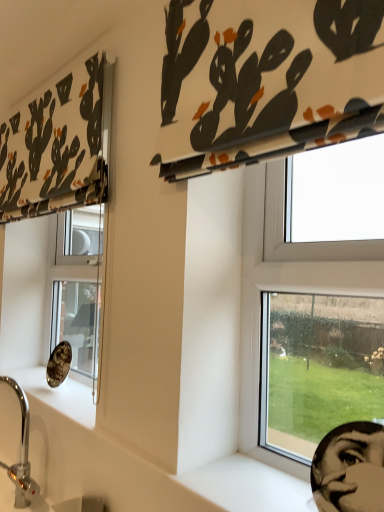
In order to face chrome metallic sink at lower left, should I rotate leftwards or rightwards?

To face it directly, rotate left by 23.007 degrees.

At what (x,y) coordinates should I click in order to perform the action: click on chrome metallic sink at lower left. Please return your answer as a coordinate pair (x, y). Looking at the image, I should click on (30, 471).

What do you see at coordinates (252, 482) in the screenshot?
I see `white smooth window sill at lower right` at bounding box center [252, 482].

The image size is (384, 512). Find the location of `white fabric with black and orange cactus print at upper left, the 1th curtain in the left-to-right sequence`. white fabric with black and orange cactus print at upper left, the 1th curtain in the left-to-right sequence is located at coordinates click(x=59, y=145).

What do you see at coordinates (59, 145) in the screenshot? This screenshot has width=384, height=512. I see `white fabric with black and orange cactus print at upper left, the 1th curtain in the left-to-right sequence` at bounding box center [59, 145].

What are the coordinates of `chrome metallic sink at lower left` in the screenshot? It's located at (30, 471).

Is matte black fabric at upper center, which appears as the 1th curtain when viewed from the front, in front of or behind chrome metallic sink at lower left in the image?

matte black fabric at upper center, which appears as the 1th curtain when viewed from the front, is positioned closer to the viewer than chrome metallic sink at lower left.

Can you confirm if matte black fabric at upper center, arranged as the first curtain when viewed from the right, is taller than chrome metallic sink at lower left?

Correct, matte black fabric at upper center, arranged as the first curtain when viewed from the right, is much taller as chrome metallic sink at lower left.

From a real-world perspective, between matte black fabric at upper center, the 2th curtain positioned from the left, and chrome metallic sink at lower left, who is vertically higher?

matte black fabric at upper center, the 2th curtain positioned from the left, from a real-world perspective.

Which object is wider, matte black fabric at upper center, which appears as the 1th curtain when viewed from the front, or chrome metallic sink at lower left?

chrome metallic sink at lower left is wider.

Does transparent glass window at center right have a smaller size compared to white fabric with black and orange cactus print at upper left, the 1th curtain in the left-to-right sequence?

Correct, transparent glass window at center right occupies less space than white fabric with black and orange cactus print at upper left, the 1th curtain in the left-to-right sequence.

Who is taller, transparent glass window at center right or white fabric with black and orange cactus print at upper left, the first curtain from the back?

With more height is transparent glass window at center right.

Is transparent glass window at center right turned away from white fabric with black and orange cactus print at upper left, the 1th curtain in the left-to-right sequence?

transparent glass window at center right does not have its back to white fabric with black and orange cactus print at upper left, the 1th curtain in the left-to-right sequence.

Where is `window that is on the right side of white fabric with black and orange cactus print at upper left, marked as the second curtain in a right-to-left arrangement`? The image size is (384, 512). window that is on the right side of white fabric with black and orange cactus print at upper left, marked as the second curtain in a right-to-left arrangement is located at coordinates (288, 275).

What's the angular difference between transparent glass window at center right and black matte human face at lower right's facing directions?

The angular difference between transparent glass window at center right and black matte human face at lower right is 3.98 degrees.

Between transparent glass window at center right and black matte human face at lower right, which one has smaller size?

With smaller size is black matte human face at lower right.

Is the surface of transparent glass window at center right in direct contact with black matte human face at lower right?

There is a gap between transparent glass window at center right and black matte human face at lower right.

Consider the image. Is transparent glass window at center right in front of black matte human face at lower right?

No, it is not.

In the scene shown: Does black matte human face at lower right have a lesser width compared to white fabric with black and orange cactus print at upper left, the 1th curtain in the left-to-right sequence?

In fact, black matte human face at lower right might be wider than white fabric with black and orange cactus print at upper left, the 1th curtain in the left-to-right sequence.

In the image, is black matte human face at lower right positioned in front of or behind white fabric with black and orange cactus print at upper left, the 2th curtain viewed from the front?

black matte human face at lower right is in front of white fabric with black and orange cactus print at upper left, the 2th curtain viewed from the front.

From the image's perspective, is black matte human face at lower right located above or below white fabric with black and orange cactus print at upper left, the 1th curtain in the left-to-right sequence?

Based on their image positions, black matte human face at lower right is located beneath white fabric with black and orange cactus print at upper left, the 1th curtain in the left-to-right sequence.

In the scene shown: From their relative heights in the image, would you say white fabric with black and orange cactus print at upper left, marked as the second curtain in a right-to-left arrangement, is taller or shorter than matte black fabric at upper center, arranged as the first curtain when viewed from the right?

Clearly, white fabric with black and orange cactus print at upper left, marked as the second curtain in a right-to-left arrangement, is taller compared to matte black fabric at upper center, arranged as the first curtain when viewed from the right.

How different are the orientations of white fabric with black and orange cactus print at upper left, the 2th curtain viewed from the front, and matte black fabric at upper center, arranged as the first curtain when viewed from the right, in degrees?

The facing directions of white fabric with black and orange cactus print at upper left, the 2th curtain viewed from the front, and matte black fabric at upper center, arranged as the first curtain when viewed from the right, are 0.000847 degrees apart.

Is white fabric with black and orange cactus print at upper left, the 1th curtain in the left-to-right sequence, thinner than matte black fabric at upper center, the 2th curtain positioned from the left?

Yes, white fabric with black and orange cactus print at upper left, the 1th curtain in the left-to-right sequence, is thinner than matte black fabric at upper center, the 2th curtain positioned from the left.

From the image's perspective, would you say white fabric with black and orange cactus print at upper left, the 2th curtain viewed from the front, is positioned over matte black fabric at upper center, the 2th curtain positioned from the left?

No, from the image's perspective, white fabric with black and orange cactus print at upper left, the 2th curtain viewed from the front, is not above matte black fabric at upper center, the 2th curtain positioned from the left.

Consider the image. From the image's perspective, which one is positioned higher, matte black fabric at upper center, which appears as the 1th curtain when viewed from the front, or white fabric with black and orange cactus print at upper left, marked as the second curtain in a right-to-left arrangement?

matte black fabric at upper center, which appears as the 1th curtain when viewed from the front, appears higher in the image.

Does matte black fabric at upper center, which appears as the 1th curtain when viewed from the front, appear on the right side of white fabric with black and orange cactus print at upper left, the first curtain from the back?

Correct, you'll find matte black fabric at upper center, which appears as the 1th curtain when viewed from the front, to the right of white fabric with black and orange cactus print at upper left, the first curtain from the back.

Is matte black fabric at upper center, arranged as the first curtain when viewed from the right, closer to the viewer compared to white fabric with black and orange cactus print at upper left, the 1th curtain in the left-to-right sequence?

Yes, it is in front of white fabric with black and orange cactus print at upper left, the 1th curtain in the left-to-right sequence.

Which object is thinner, matte black fabric at upper center, which appears as the 1th curtain when viewed from the front, or white fabric with black and orange cactus print at upper left, marked as the second curtain in a right-to-left arrangement?

white fabric with black and orange cactus print at upper left, marked as the second curtain in a right-to-left arrangement, is thinner.

From a real-world perspective, is matte black fabric at upper center, placed as the 2th curtain when sorted from back to front, positioned over white smooth window sill at lower right based on gravity?

Correct, in the physical world, matte black fabric at upper center, placed as the 2th curtain when sorted from back to front, is higher than white smooth window sill at lower right.

Are matte black fabric at upper center, which appears as the 1th curtain when viewed from the front, and white smooth window sill at lower right far apart?

No, matte black fabric at upper center, which appears as the 1th curtain when viewed from the front, is not far away from white smooth window sill at lower right.

Is matte black fabric at upper center, arranged as the first curtain when viewed from the right, completely or partially outside of white smooth window sill at lower right?

That's correct, matte black fabric at upper center, arranged as the first curtain when viewed from the right, is outside of white smooth window sill at lower right.

Is matte black fabric at upper center, arranged as the first curtain when viewed from the right, smaller than white smooth window sill at lower right?

Actually, matte black fabric at upper center, arranged as the first curtain when viewed from the right, might be larger than white smooth window sill at lower right.

In order to click on the 1st curtain above the chrome metallic sink at lower left (from a real-world perspective) in this screenshot , I will do `click(266, 79)`.

At what (x,y) coordinates should I click in order to perform the action: click on window below the white fabric with black and orange cactus print at upper left, the 2th curtain viewed from the front (from a real-world perspective). Please return your answer as a coordinate pair (x, y). The image size is (384, 512). Looking at the image, I should click on (288, 275).

Based on their spatial positions, is transparent glass window at center right or chrome metallic sink at lower left closer to matte black fabric at upper center, the 2th curtain positioned from the left?

Among the two, transparent glass window at center right is located nearer to matte black fabric at upper center, the 2th curtain positioned from the left.

When comparing their distances from chrome metallic sink at lower left, does white smooth window sill at lower right or black matte human face at lower right seem closer?

The object closer to chrome metallic sink at lower left is white smooth window sill at lower right.

Estimate the real-world distances between objects in this image. Which object is closer to white fabric with black and orange cactus print at upper left, marked as the second curtain in a right-to-left arrangement, matte black fabric at upper center, arranged as the first curtain when viewed from the right, or white smooth window sill at lower right?

matte black fabric at upper center, arranged as the first curtain when viewed from the right, is positioned closer to the anchor white fabric with black and orange cactus print at upper left, marked as the second curtain in a right-to-left arrangement.

When comparing their distances from white smooth window sill at lower right, does transparent glass window at center right or white fabric with black and orange cactus print at upper left, marked as the second curtain in a right-to-left arrangement, seem further?

white fabric with black and orange cactus print at upper left, marked as the second curtain in a right-to-left arrangement, is further to white smooth window sill at lower right.

Consider the image. Looking at the image, which one is located further to white fabric with black and orange cactus print at upper left, marked as the second curtain in a right-to-left arrangement, white smooth window sill at lower right or transparent glass window at center right?

white smooth window sill at lower right is positioned further to the anchor white fabric with black and orange cactus print at upper left, marked as the second curtain in a right-to-left arrangement.

When comparing their distances from white fabric with black and orange cactus print at upper left, the 1th curtain in the left-to-right sequence, does black matte human face at lower right or transparent glass window at center right seem closer?

transparent glass window at center right is closer to white fabric with black and orange cactus print at upper left, the 1th curtain in the left-to-right sequence.

When comparing their distances from matte black fabric at upper center, arranged as the first curtain when viewed from the right, does white smooth window sill at lower right or white fabric with black and orange cactus print at upper left, marked as the second curtain in a right-to-left arrangement, seem further?

Based on the image, white smooth window sill at lower right appears to be further to matte black fabric at upper center, arranged as the first curtain when viewed from the right.

When comparing their distances from chrome metallic sink at lower left, does white smooth window sill at lower right or transparent glass window at center right seem further?

The object further to chrome metallic sink at lower left is transparent glass window at center right.

Find the location of a particular element. The image size is (384, 512). window sill between white fabric with black and orange cactus print at upper left, the 1th curtain in the left-to-right sequence, and transparent glass window at center right, in the horizontal direction is located at coordinates (252, 482).

This screenshot has height=512, width=384. In order to click on curtain between white fabric with black and orange cactus print at upper left, the 1th curtain in the left-to-right sequence, and transparent glass window at center right from left to right in this screenshot , I will do `click(266, 79)`.

Identify the location of window sill situated between chrome metallic sink at lower left and black matte human face at lower right from left to right. (252, 482).

Identify the location of human face between matte black fabric at upper center, which appears as the 1th curtain when viewed from the front, and chrome metallic sink at lower left vertically. (352, 472).